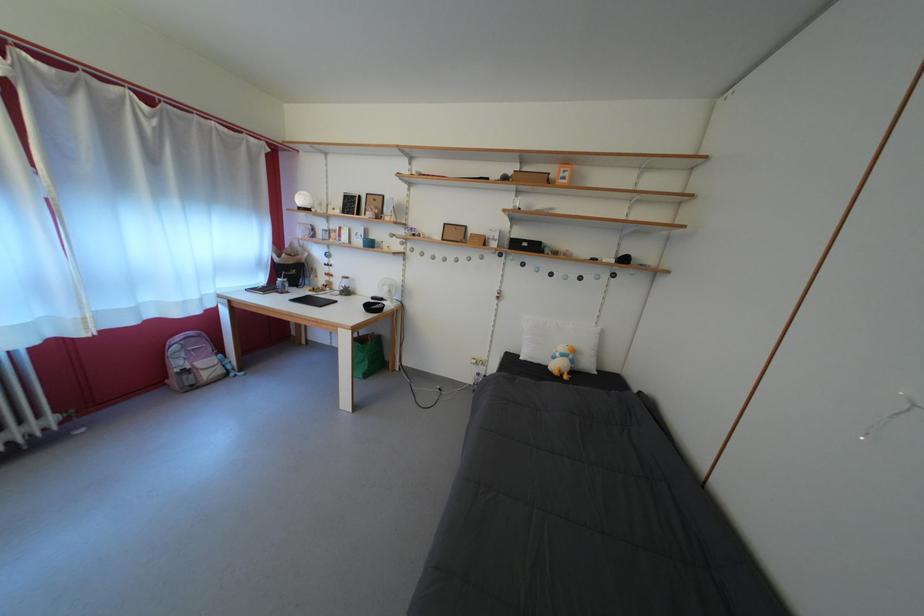
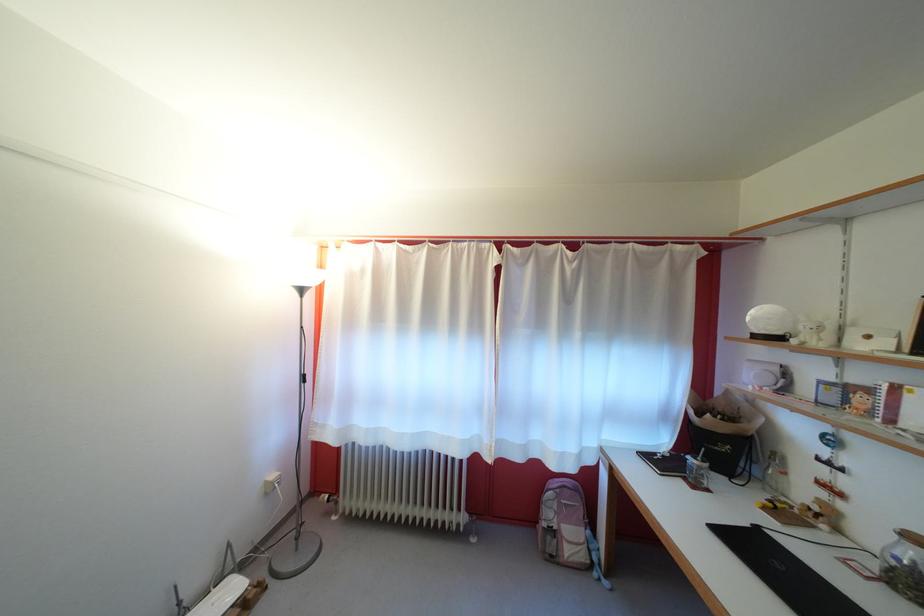
The point at (292, 288) is marked in the first image. Where is the corresponding point in the second image?

(708, 474)